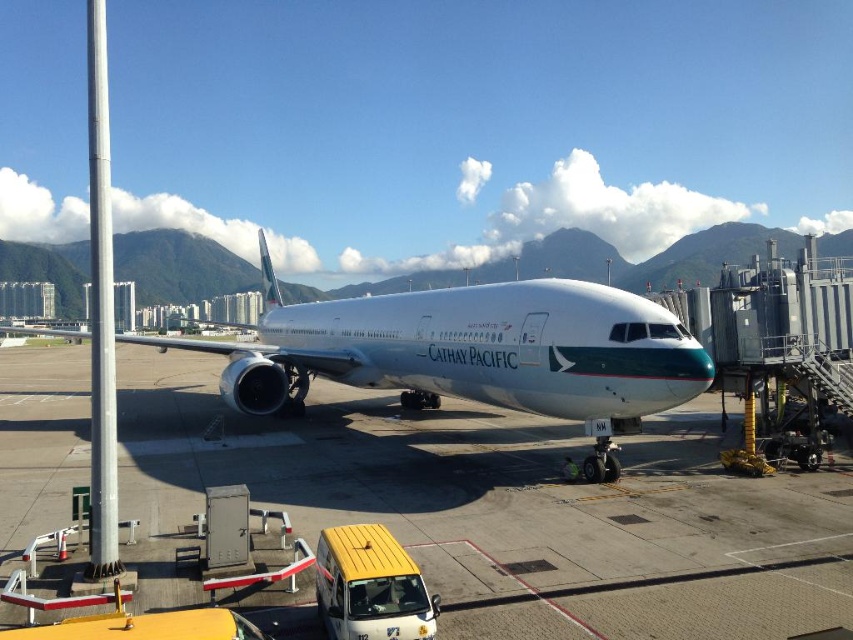
Question: Which object is closer to the camera taking this photo?

Choices:
 (A) white glossy airplane at center
 (B) white glossy tarmac at center

Answer: (B)

Question: Is white glossy tarmac at center in front of white glossy airplane at center?

Choices:
 (A) yes
 (B) no

Answer: (A)

Question: Does white glossy tarmac at center have a smaller size compared to white glossy airplane at center?

Choices:
 (A) yes
 (B) no

Answer: (A)

Question: Can you confirm if white glossy tarmac at center is positioned to the left of white glossy airplane at center?

Choices:
 (A) no
 (B) yes

Answer: (A)

Question: Which object appears closest to the camera in this image?

Choices:
 (A) white glossy airplane at center
 (B) white glossy tarmac at center

Answer: (B)

Question: Which point appears farthest from the camera in this image?

Choices:
 (A) [483, 326]
 (B) [486, 554]

Answer: (A)